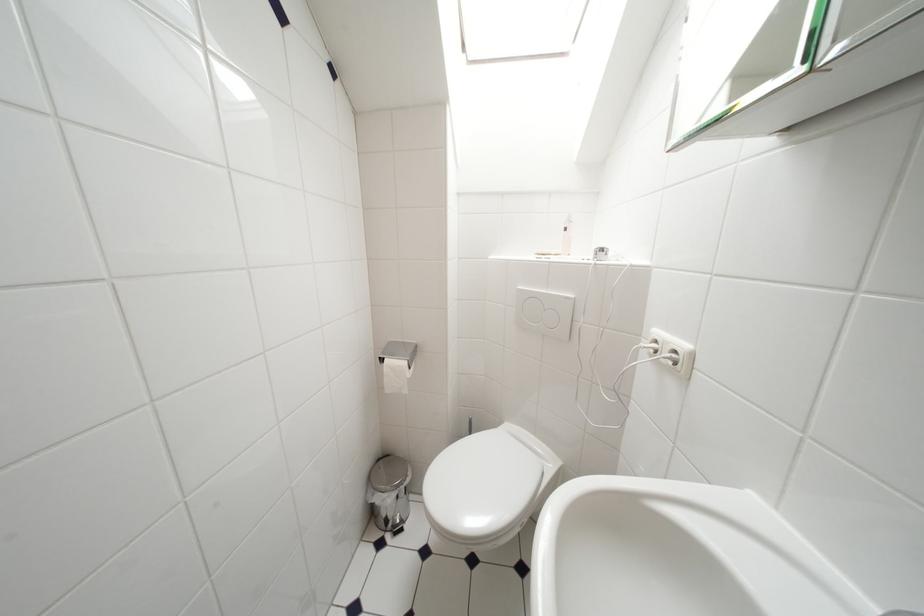
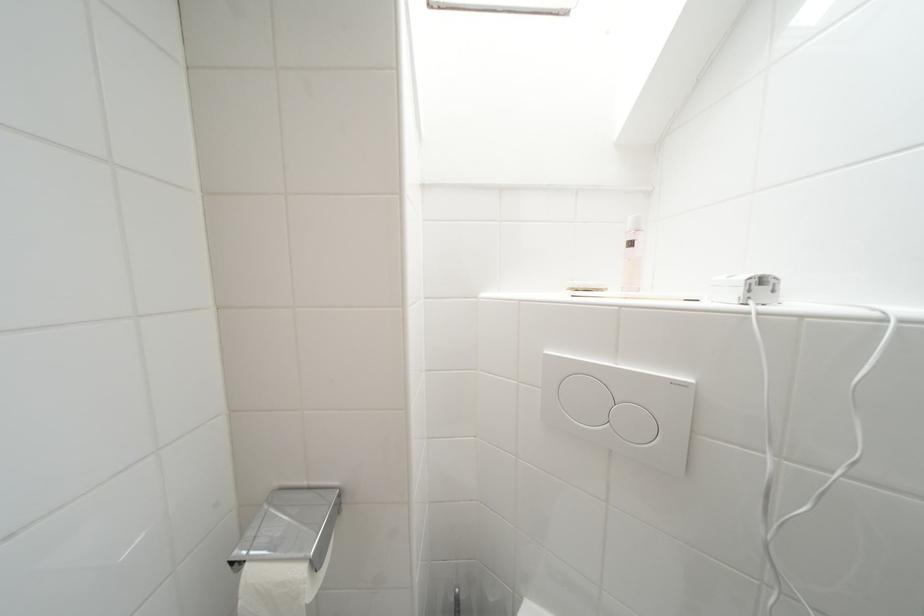
The point at (x=573, y=233) is marked in the first image. Where is the corresponding point in the second image?

(638, 246)